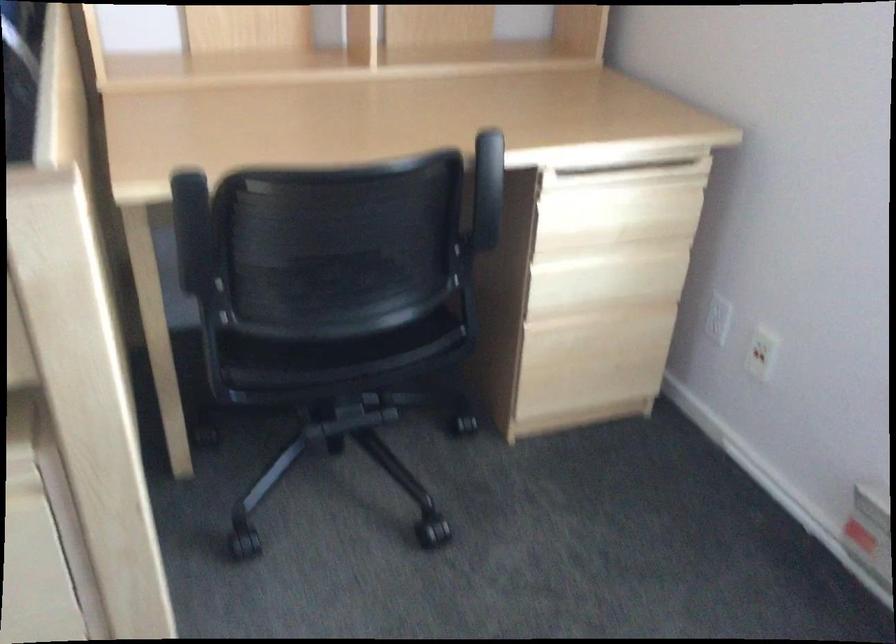
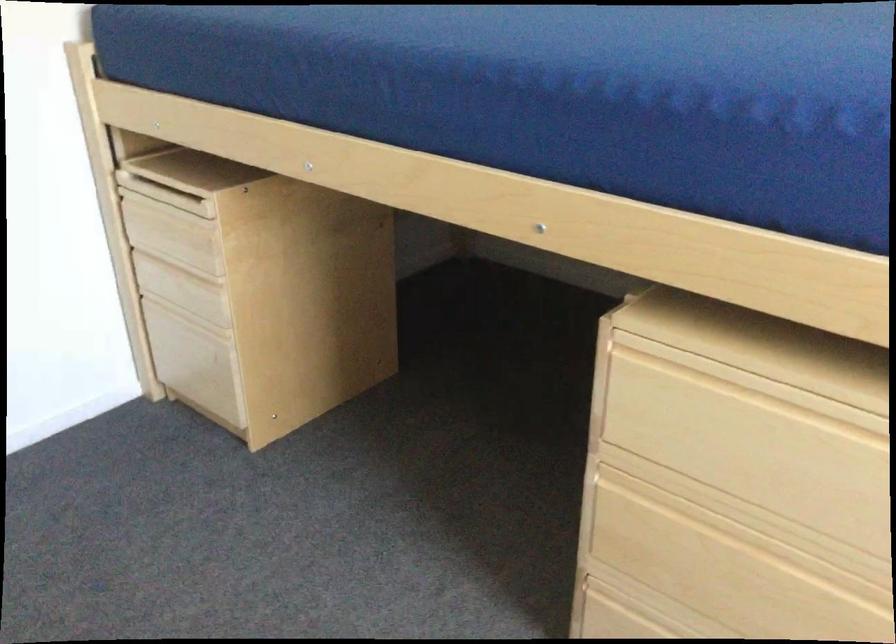
Question: The camera is either moving clockwise (left) or counter-clockwise (right) around the object. The first image is from the beginning of the video and the second image is from the end. Is the camera moving left or right when shooting the video?

Choices:
 (A) Left
 (B) Right

Answer: (B)